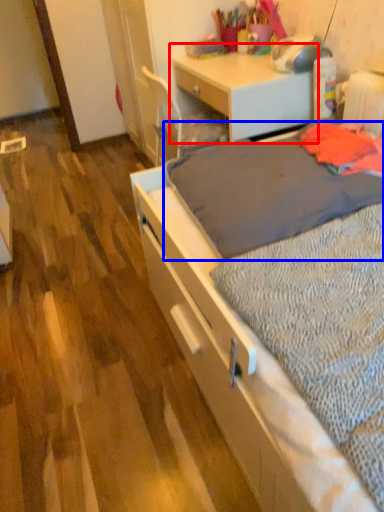
Question: Which point is closer to the camera, desk (highlighted by a red box) or blanket (highlighted by a blue box)?

Choices:
 (A) desk
 (B) blanket

Answer: (B)